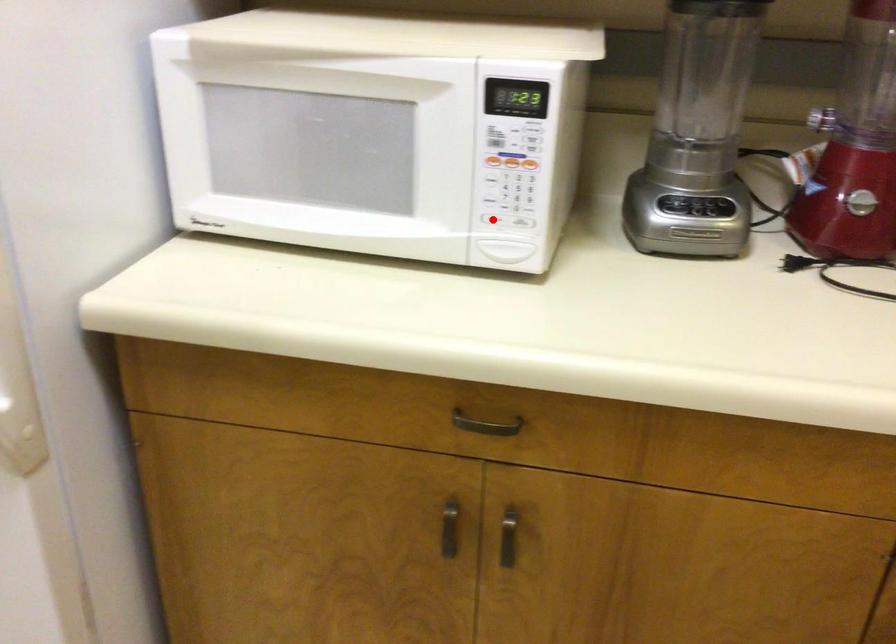
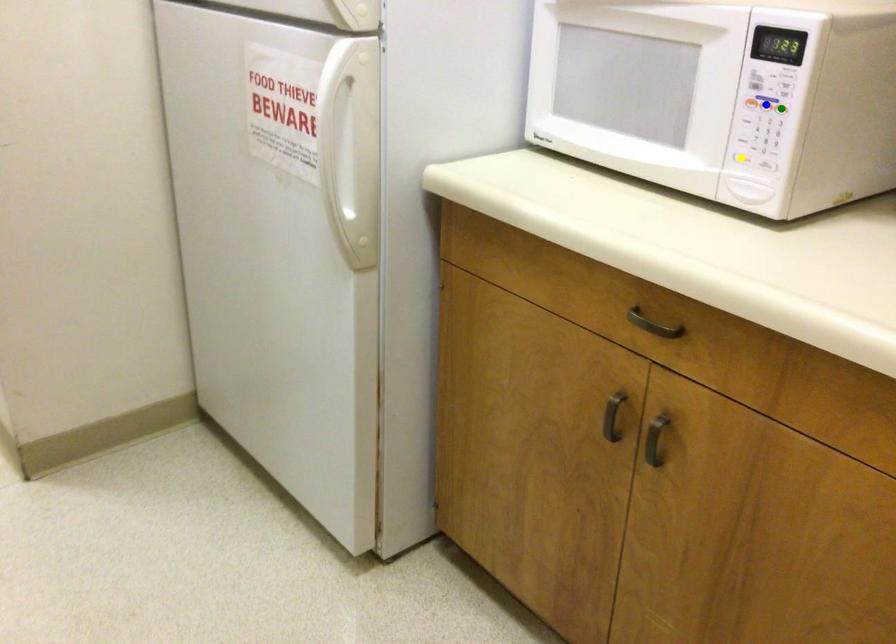
Question: I am providing you with two images of the same scene from different viewpoints. A red point is marked on the first image. You are given multiple points on the second image. Can you choose the point in image 2 that corresponds to the point in image 1?

Choices:
 (A) yellow point
 (B) green point
 (C) blue point

Answer: (A)